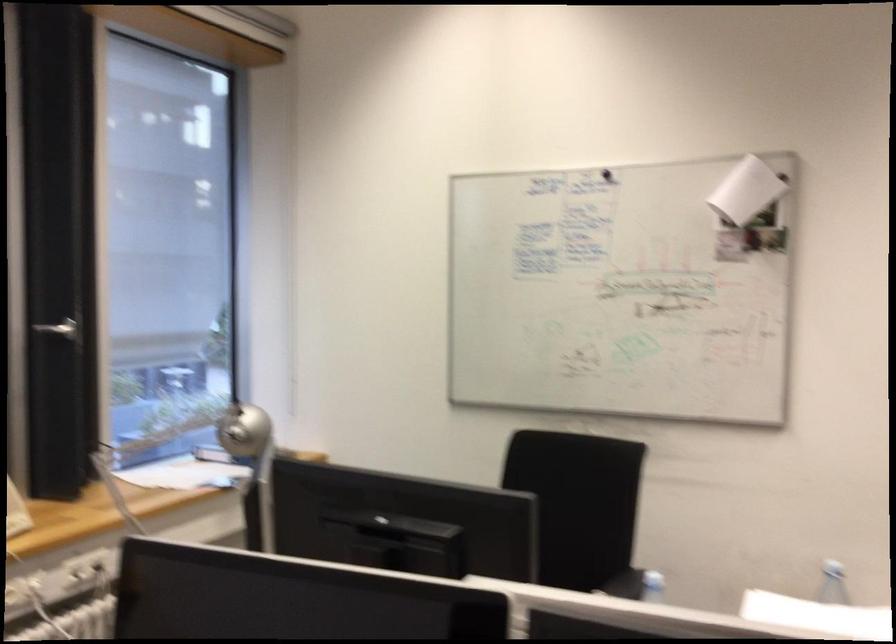
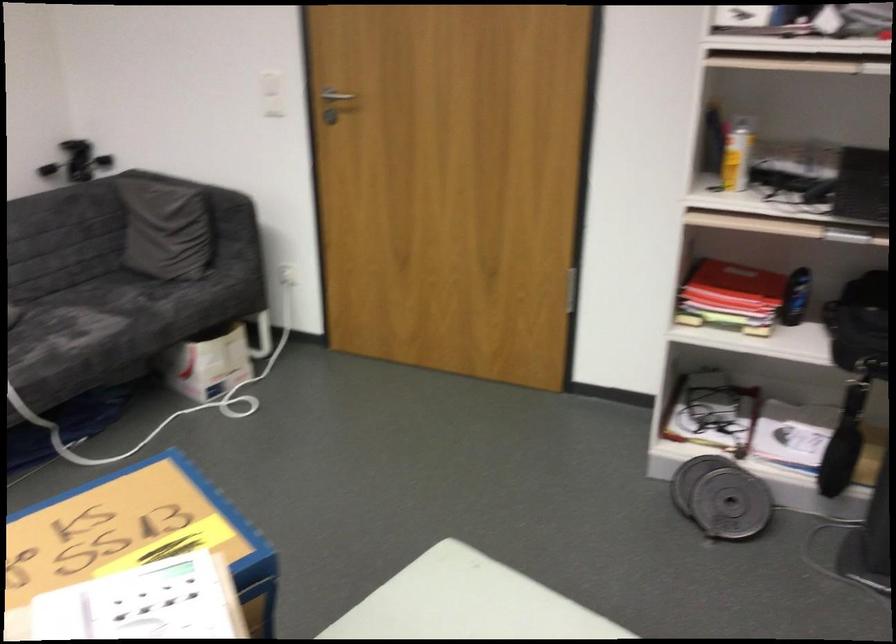
First-person continuous shooting, in which direction is the camera rotating?

The rotation direction of the camera is right-down.